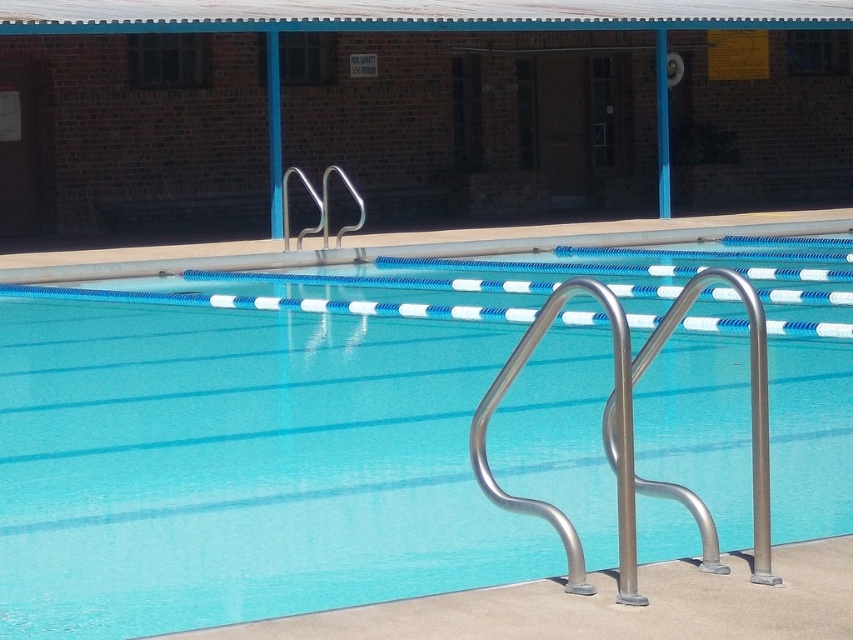
You are a lifeguard standing at the edge of the pool and need to reach both the clear blue water at center and the concrete at center. Which one is closer to you?

The clear blue water at center and concrete at center are 5.11 meters apart, so they are equally distant from you.

You are a lifeguard standing at the edge of the pool. You need to check the depth of the water where the clear blue water at center is located. Can you determine if the depth there is deeper than the height of the silver metallic rail at upper center?

The clear blue water at center is much taller than the silver metallic rail at upper center, so the depth of the water at the center is deeper than the height of the rail.

Consider the image. What are the coordinates of the clear blue water at center?

The clear blue water at center is located at point (250, 449).